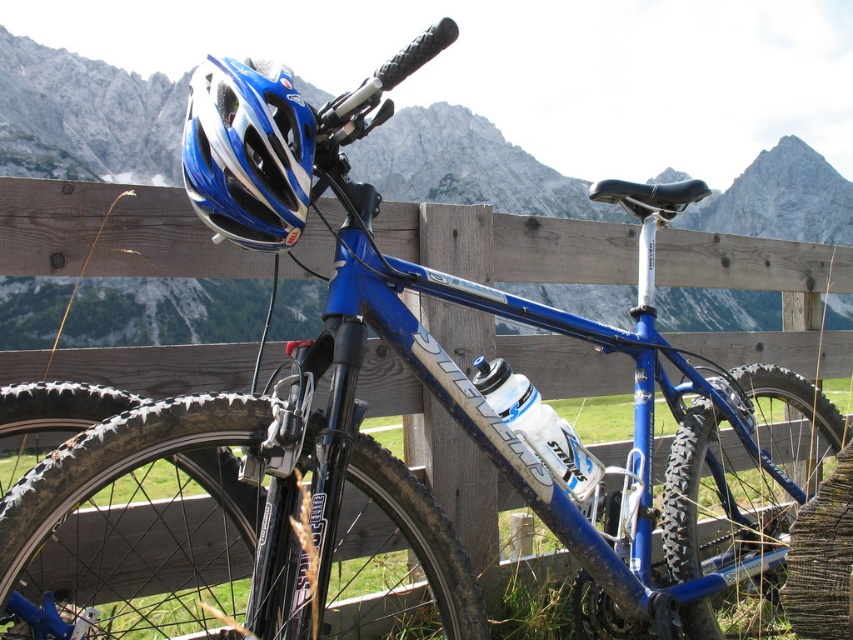
You are planning to attach a GPS tracker to either the blue glossy helmet at upper left or the white glossy water bottle at center. Which object would you choose if you want the tracker to be more visible from a distance?

The blue glossy helmet at upper left is larger in size than the white glossy water bottle at center, so the GPS tracker would be more visible on the blue glossy helmet at upper left.